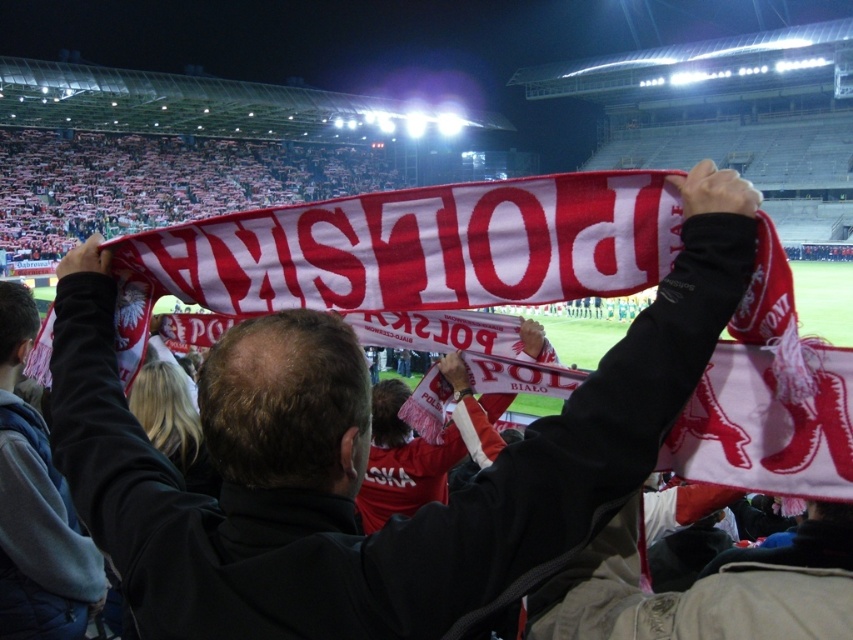
Between matte red scarf at center and gray fleece jacket at upper left, which one appears on the left side from the viewer's perspective?

gray fleece jacket at upper left is more to the left.

Is matte red scarf at center thinner than gray fleece jacket at upper left?

In fact, matte red scarf at center might be wider than gray fleece jacket at upper left.

You are a GUI agent. You are given a task and a screenshot of the screen. Output one action in this format:
    pyautogui.click(x=<x>, y=<y>)
    Task: Click on the matte red scarf at center
    Image resolution: width=853 pixels, height=640 pixels.
    Given the screenshot: What is the action you would take?
    pyautogui.click(x=364, y=460)